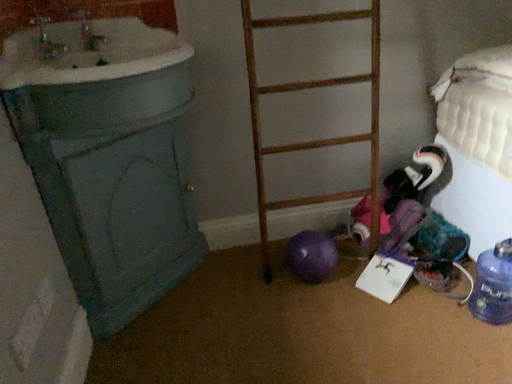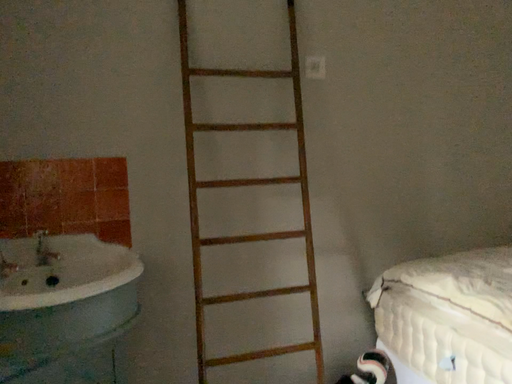
Question: How did the camera likely rotate when shooting the video?

Choices:
 (A) rotated downward
 (B) rotated upward

Answer: (B)